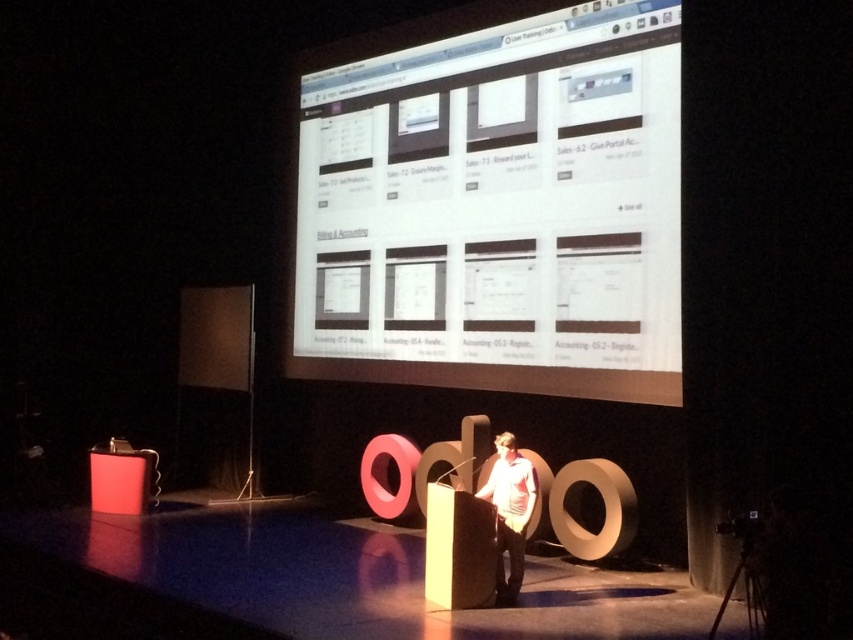
Question: Can you confirm if white glossy computer screen at upper center is smaller than light pink fabric shirt at center?

Choices:
 (A) yes
 (B) no

Answer: (B)

Question: Can you confirm if white glossy computer screen at upper center is positioned to the left of light pink fabric shirt at center?

Choices:
 (A) yes
 (B) no

Answer: (A)

Question: Is white glossy computer screen at upper center bigger than light pink fabric shirt at center?

Choices:
 (A) no
 (B) yes

Answer: (B)